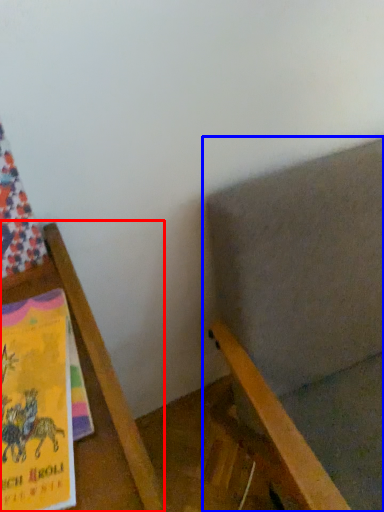
Question: Among these objects, which one is farthest to the camera, furniture (highlighted by a red box) or chair (highlighted by a blue box)?

Choices:
 (A) furniture
 (B) chair

Answer: (B)